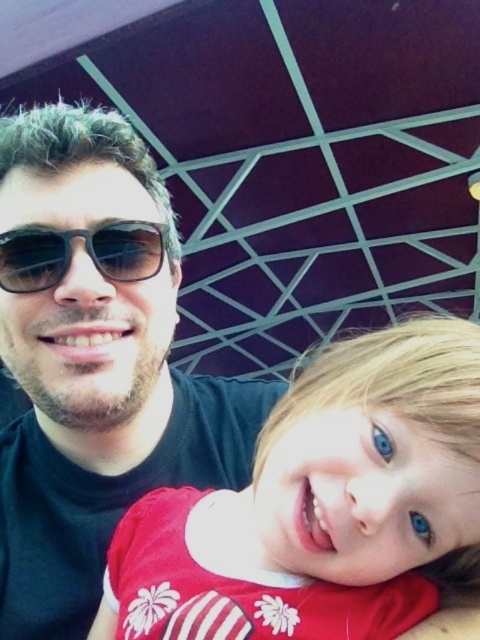
Between point (289, 420) and point (60, 244), which one is positioned in front?

Positioned in front is point (289, 420).

Does matte red shirt at center have a larger size compared to shiny brown aviator sunglasses at center?

Yes.

This screenshot has height=640, width=480. Describe the element at coordinates (320, 500) in the screenshot. I see `matte red shirt at center` at that location.

The width and height of the screenshot is (480, 640). In order to click on matte red shirt at center in this screenshot , I will do (320, 500).

The image size is (480, 640). What do you see at coordinates (94, 365) in the screenshot?
I see `matte black sunglasses at upper left` at bounding box center [94, 365].

Which of these two, matte black sunglasses at upper left or matte red shirt at center, stands taller?

matte black sunglasses at upper left

This screenshot has height=640, width=480. Describe the element at coordinates (94, 365) in the screenshot. I see `matte black sunglasses at upper left` at that location.

The height and width of the screenshot is (640, 480). I want to click on matte black sunglasses at upper left, so click(x=94, y=365).

Who is more forward, [93,484] or [3,234]?

Point [3,234] is more forward.

Where is `matte black sunglasses at upper left`? This screenshot has width=480, height=640. matte black sunglasses at upper left is located at coordinates (94, 365).

At what (x,y) coordinates should I click in order to perform the action: click on matte black sunglasses at upper left. Please return your answer as a coordinate pair (x, y). Looking at the image, I should click on (94, 365).